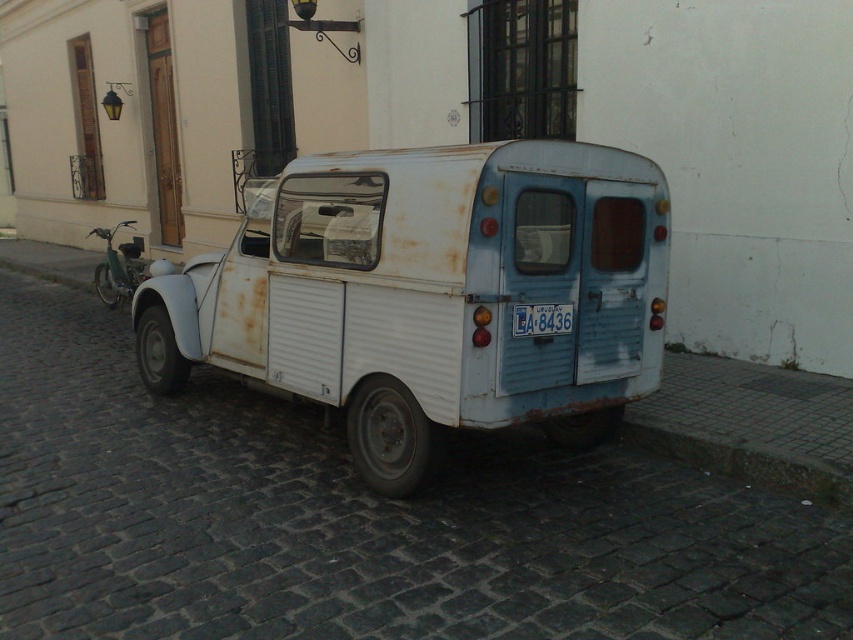
You are a photographer standing 4 meters away from the rusty metal van at center. You want to capture a photo of the van without any distortion. What should you do?

Since the rusty metal van at center and the camera are 4.02 meters apart, you should position yourself exactly at that distance to avoid distortion and ensure the van is captured clearly in the photo.

You are a delivery driver trying to read the license plate of the rusty metal van at center. Can you see the white plastic license plate at center clearly from your current position?

The rusty metal van at center is in front of the white plastic license plate at center, so the van is blocking the license plate, making it difficult to see clearly.

You are a delivery person trying to load a package onto the rusty metal van at center. The package is 1.2 meters wide. Can the package fit on the van if the white plastic license plate at center is in the way?

The rusty metal van at center is larger in size than the white plastic license plate at center, so the package can fit on the van as long as it is placed away from the license plate.